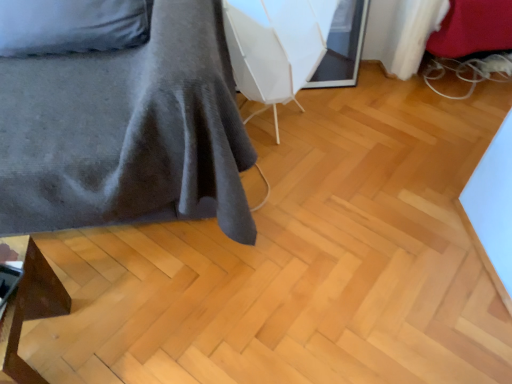
Question: Is matte brown wooden stool at lower left, the first furniture ordered from the bottom, smaller than white plastic swivel chair at center?

Choices:
 (A) no
 (B) yes

Answer: (B)

Question: Does matte brown wooden stool at lower left, the first furniture ordered from the bottom, lie in front of white plastic swivel chair at center?

Choices:
 (A) yes
 (B) no

Answer: (A)

Question: Considering the relative sizes of matte brown wooden stool at lower left, which ranks as the 2th furniture in top-to-bottom order, and white plastic swivel chair at center in the image provided, is matte brown wooden stool at lower left, which ranks as the 2th furniture in top-to-bottom order, wider than white plastic swivel chair at center?

Choices:
 (A) yes
 (B) no

Answer: (B)

Question: From the image's perspective, would you say matte brown wooden stool at lower left, the first furniture ordered from the bottom, is shown under white plastic swivel chair at center?

Choices:
 (A) no
 (B) yes

Answer: (B)

Question: From the image's perspective, is matte brown wooden stool at lower left, which ranks as the 2th furniture in top-to-bottom order, located above white plastic swivel chair at center?

Choices:
 (A) yes
 (B) no

Answer: (B)

Question: From the image's perspective, is velvet grey bedspread at left, positioned as the second furniture in bottom-to-top order, located above or below matte brown wooden stool at lower left, which ranks as the 2th furniture in top-to-bottom order?

Choices:
 (A) above
 (B) below

Answer: (A)

Question: Looking at their shapes, would you say velvet grey bedspread at left, the 1th furniture in the top-to-bottom sequence, is wider or thinner than matte brown wooden stool at lower left, which ranks as the 2th furniture in top-to-bottom order?

Choices:
 (A) thin
 (B) wide

Answer: (B)

Question: In terms of size, does velvet grey bedspread at left, the 1th furniture in the top-to-bottom sequence, appear bigger or smaller than matte brown wooden stool at lower left, the first furniture ordered from the bottom?

Choices:
 (A) big
 (B) small

Answer: (A)

Question: Considering their positions, is velvet grey bedspread at left, the 1th furniture in the top-to-bottom sequence, located in front of or behind matte brown wooden stool at lower left, which ranks as the 2th furniture in top-to-bottom order?

Choices:
 (A) front
 (B) behind

Answer: (A)

Question: Is point (269, 46) positioned closer to the camera than point (16, 175)?

Choices:
 (A) closer
 (B) farther

Answer: (B)

Question: Based on their sizes in the image, would you say white plastic swivel chair at center is bigger or smaller than velvet grey bedspread at left, the 1th furniture in the top-to-bottom sequence?

Choices:
 (A) small
 (B) big

Answer: (A)

Question: In the image, is white plastic swivel chair at center positioned in front of or behind velvet grey bedspread at left, positioned as the second furniture in bottom-to-top order?

Choices:
 (A) front
 (B) behind

Answer: (B)

Question: Visually, is white plastic swivel chair at center positioned to the left or to the right of velvet grey bedspread at left, positioned as the second furniture in bottom-to-top order?

Choices:
 (A) right
 (B) left

Answer: (A)

Question: Relative to white plastic swivel chair at center, is velvet grey bedspread at left, the 1th furniture in the top-to-bottom sequence, in front or behind?

Choices:
 (A) front
 (B) behind

Answer: (A)

Question: Is velvet grey bedspread at left, the 1th furniture in the top-to-bottom sequence, inside or outside of white plastic swivel chair at center?

Choices:
 (A) inside
 (B) outside

Answer: (B)